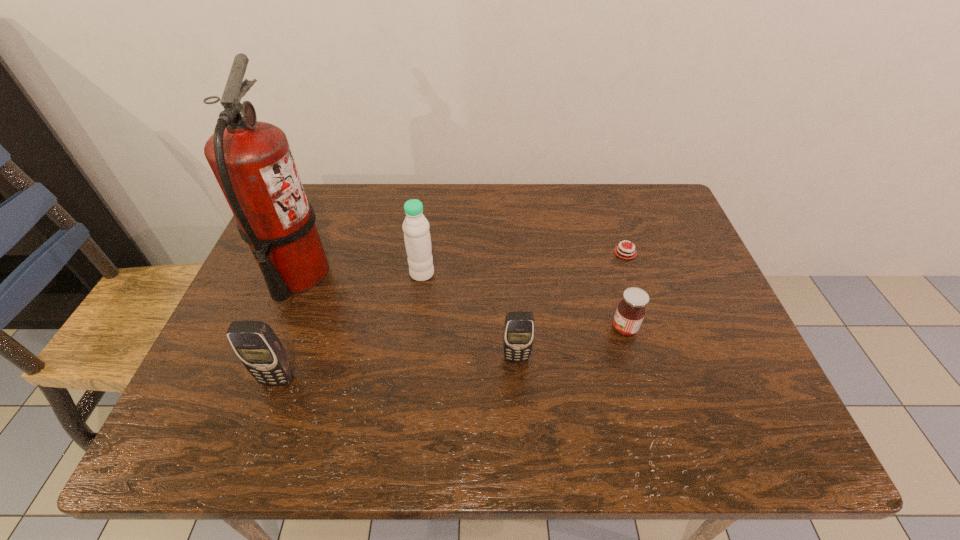
This screenshot has width=960, height=540. I want to click on vacant place for an extra cellular telephone on the right, so click(737, 338).